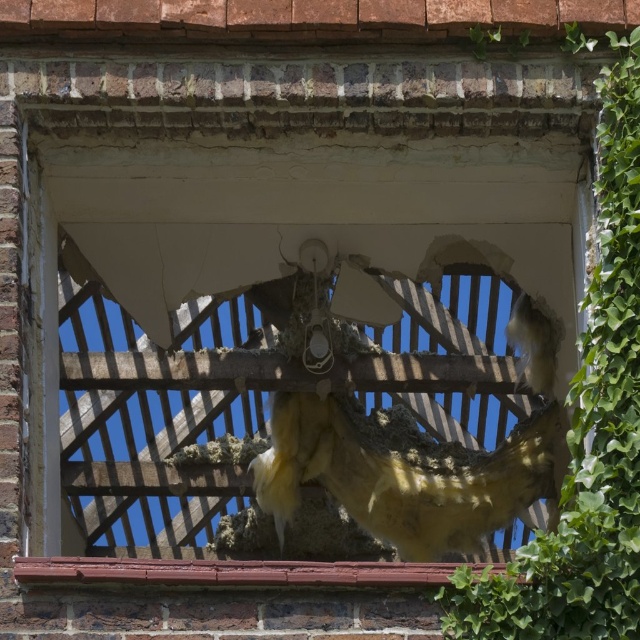
You are a construction worker assessing the damage to the building. You notice a point at coordinates (401, 477). What object is located at this point?

The point at coordinates (401, 477) indicates a fuzzy yellow bird at center.

You are a birdhouse builder observing the damaged window. You notice the fuzzy yellow bird at center and the smooth brick window sill at lower center. Which object is wider?

The smooth brick window sill at lower center is wider than the fuzzy yellow bird at center.